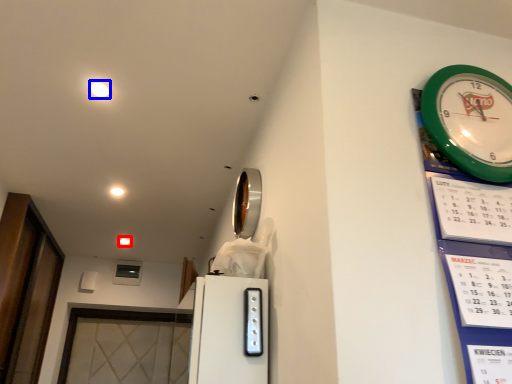
Question: Which object is closer to the camera taking this photo, light (highlighted by a red box) or light (highlighted by a blue box)?

Choices:
 (A) light
 (B) light

Answer: (B)